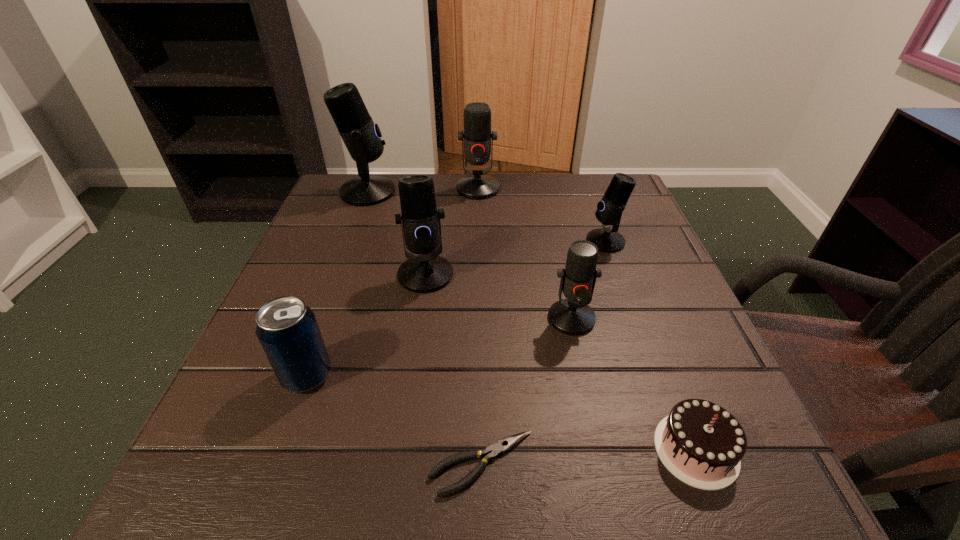
This screenshot has width=960, height=540. I want to click on the farthest black microphone, so click(x=361, y=136).

Locate an element on the screen. This screenshot has width=960, height=540. the biggest black microphone is located at coordinates (361, 136).

The width and height of the screenshot is (960, 540). In order to click on the second black microphone from right to left in this screenshot , I will do `click(427, 272)`.

Find the location of a particular element. the second nearest microphone is located at coordinates (427, 272).

This screenshot has width=960, height=540. Identify the location of the farther red microphone. (477, 135).

Locate an element on the screen. the bigger red microphone is located at coordinates (477, 135).

The image size is (960, 540). I want to click on the rightmost microphone, so click(609, 210).

The height and width of the screenshot is (540, 960). What are the coordinates of `the sixth nearest object` in the screenshot? It's located at (609, 210).

You are a GUI agent. You are given a task and a screenshot of the screen. Output one action in this format:
    pyautogui.click(x=<x>, y=<y>)
    Task: Click on the right red microphone
    This screenshot has width=960, height=540.
    Given the screenshot: What is the action you would take?
    pyautogui.click(x=572, y=316)

The width and height of the screenshot is (960, 540). I want to click on the nearest microphone, so click(572, 316).